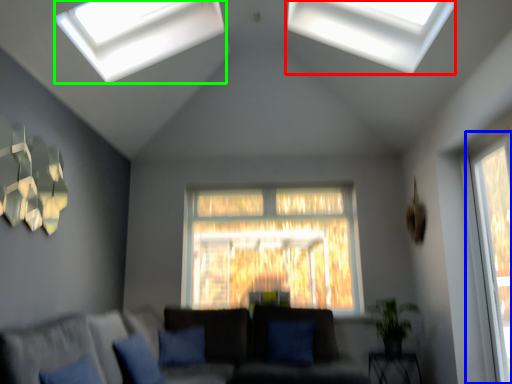
Question: Which is farther away from window (highlighted by a red box)? window (highlighted by a blue box) or window (highlighted by a green box)?

Choices:
 (A) window
 (B) window

Answer: (A)